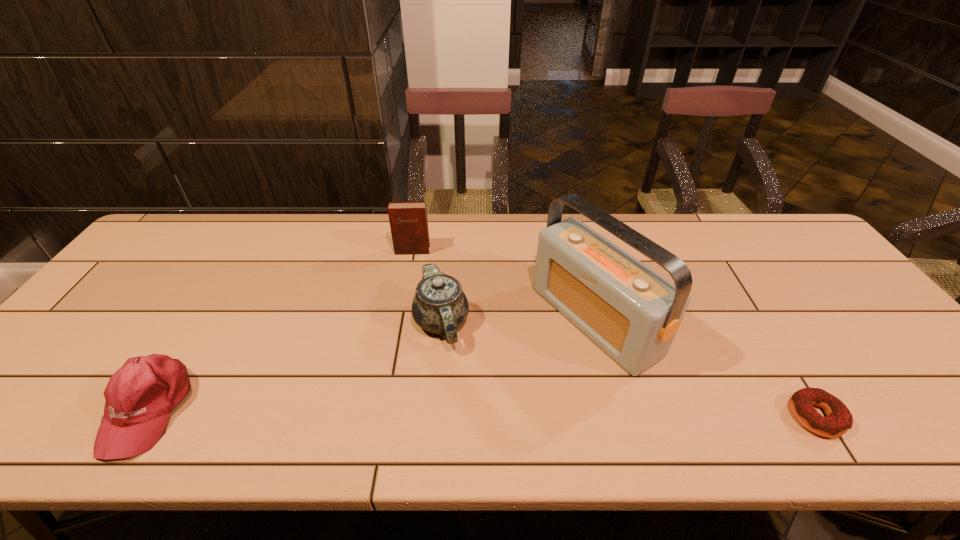
Locate an element on the screen. The width and height of the screenshot is (960, 540). free location that satisfies the following two spatial constraints: 1. on the front side of the chinaware; 2. on the left side of the farthest object is located at coordinates (399, 322).